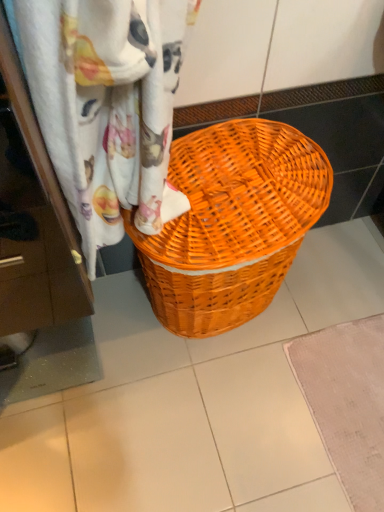
Question: From a real-world perspective, relative to orange wicker basket at center, is beige textured bath mat at lower right vertically above or below?

Choices:
 (A) below
 (B) above

Answer: (A)

Question: Looking at their shapes, would you say beige textured bath mat at lower right is wider or thinner than orange wicker basket at center?

Choices:
 (A) wide
 (B) thin

Answer: (A)

Question: Based on their relative distances, which object is nearer to the beige textured bath mat at lower right?

Choices:
 (A) orange wicker basket at center
 (B) woven fabric curtain at upper center

Answer: (A)

Question: Which object is positioned closest to the beige textured bath mat at lower right?

Choices:
 (A) woven fabric curtain at upper center
 (B) orange wicker basket at center

Answer: (B)